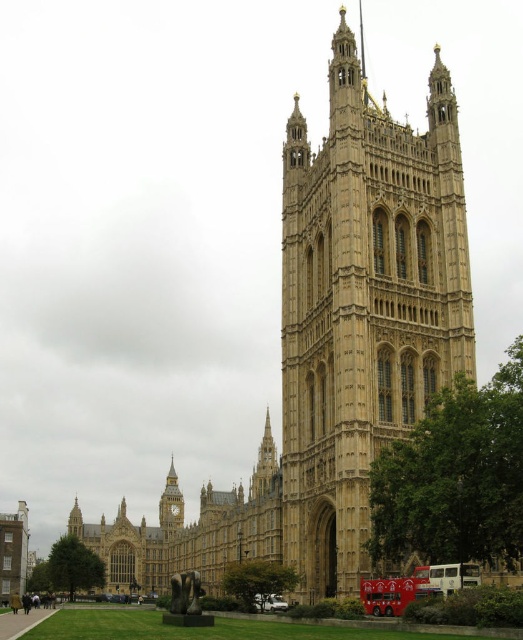
You are a city planner assessing the road capacity in front of the grand Gothic Revival building. You observe two buses parked at the lower center of the scene. Which bus has a smaller width between the red painted bus at lower center and the white metallic bus at lower center?

The red painted bus at lower center has a smaller width than the white metallic bus at lower center according to the description.

You are standing at the entrance of the grand Gothic Revival building and notice two points marked on the facade. The first point is at coordinate point [344,216] and the second is at point [422,577]. Which of these two points is closer to the entrance?

Point [422,577] is closer to the entrance because it is in front of point [344,216], which is behind it.

You are standing in front of the grand architectural structure described in the scene. You notice the golden stone tower at center. Can you determine its exact coordinates within the image?

The golden stone tower at center is located at coordinates point (363, 305).